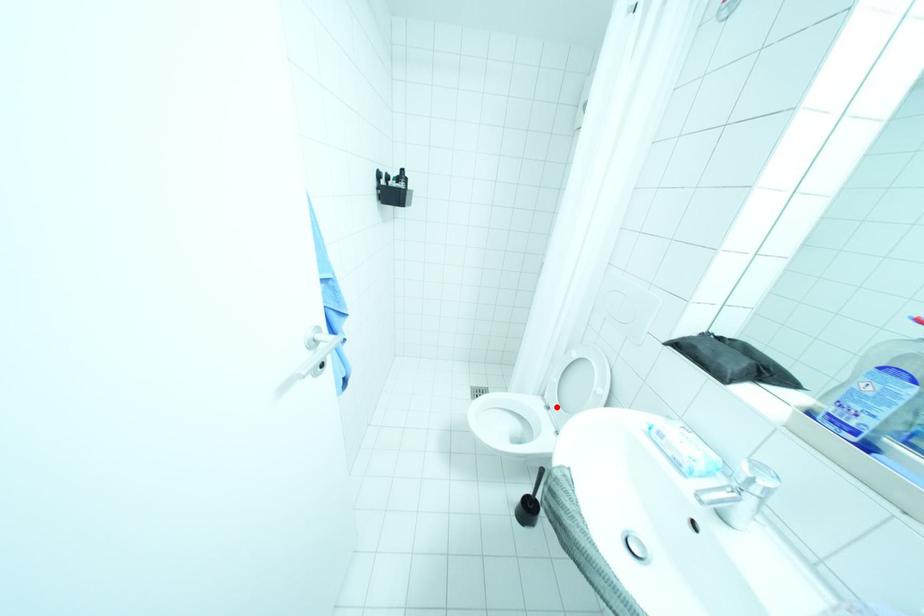
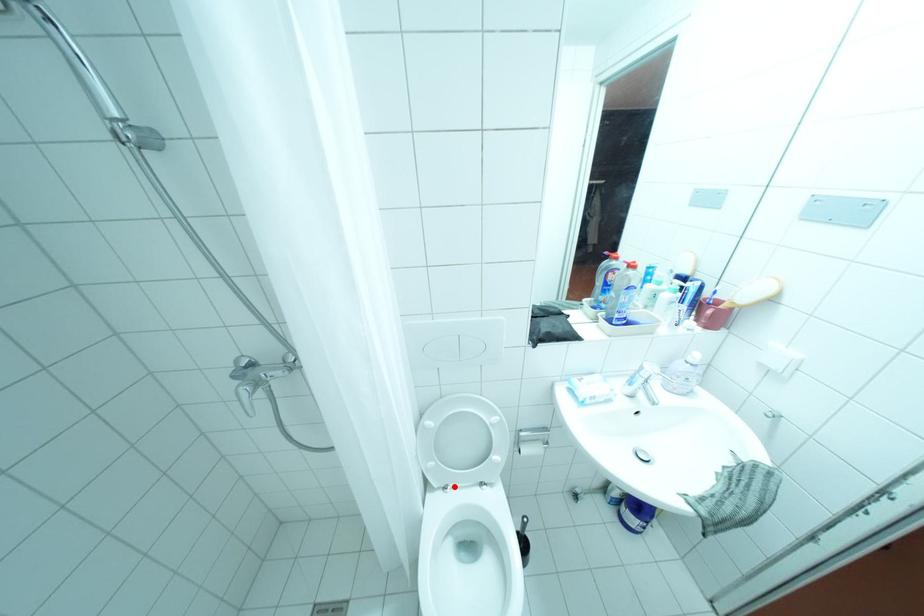
Consider the image. I am providing you with two images of the same scene from different viewpoints. A red point is marked on the first image and another point is marked on the second image. Is the marked point in image1 the same physical position as the marked point in image2?

Yes